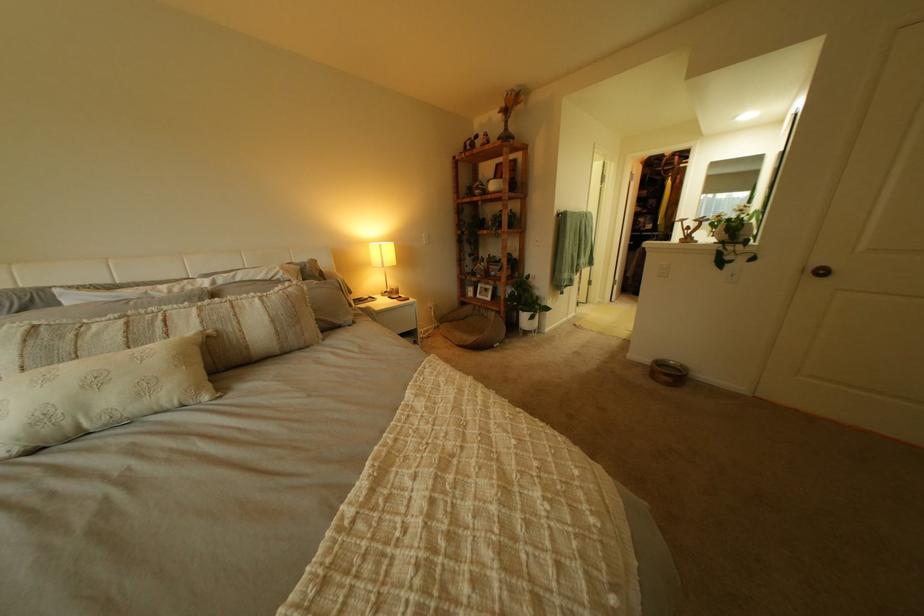
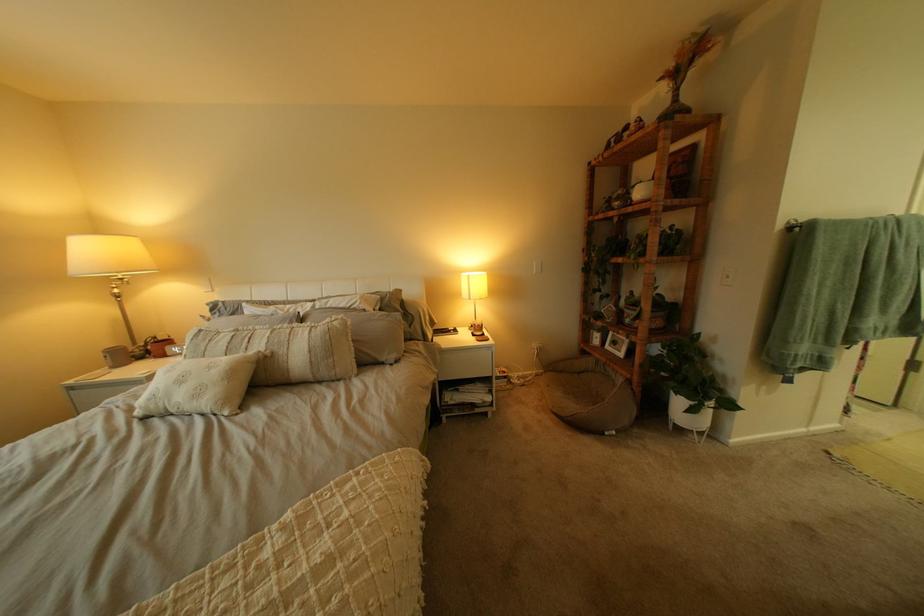
Where in the second image is the point corresponding to [396,246] from the first image?

(483, 277)